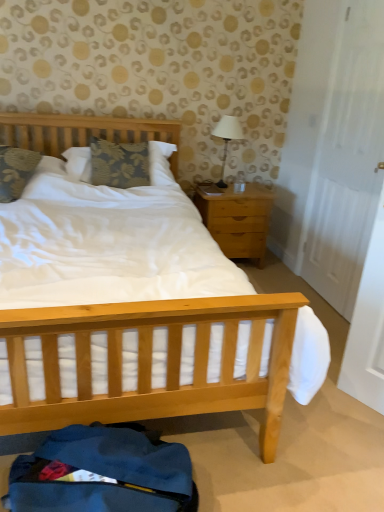
Question: Does floral fabric pillow at left, arranged as the second pillow when viewed from the right, have a lesser width compared to white fabric-covered lamp at upper right?

Choices:
 (A) yes
 (B) no

Answer: (B)

Question: Is white fabric-covered lamp at upper right inside floral fabric pillow at left, arranged as the second pillow when viewed from the right?

Choices:
 (A) no
 (B) yes

Answer: (A)

Question: Can you confirm if floral fabric pillow at left, arranged as the first pillow when viewed from the left, is smaller than white fabric-covered lamp at upper right?

Choices:
 (A) yes
 (B) no

Answer: (B)

Question: Considering the relative positions of floral fabric pillow at left, arranged as the second pillow when viewed from the right, and white fabric-covered lamp at upper right in the image provided, is floral fabric pillow at left, arranged as the second pillow when viewed from the right, to the left of white fabric-covered lamp at upper right from the viewer's perspective?

Choices:
 (A) yes
 (B) no

Answer: (A)

Question: From the image's perspective, would you say floral fabric pillow at left, arranged as the first pillow when viewed from the left, is positioned over white fabric-covered lamp at upper right?

Choices:
 (A) yes
 (B) no

Answer: (B)

Question: Is floral fabric pillow at left, arranged as the first pillow when viewed from the left, positioned before white fabric-covered lamp at upper right?

Choices:
 (A) yes
 (B) no

Answer: (A)

Question: Does light wood/texture nightstand at right appear on the left side of floral fabric pillow at left, arranged as the second pillow when viewed from the right?

Choices:
 (A) no
 (B) yes

Answer: (A)

Question: Is light wood/texture nightstand at right located outside floral fabric pillow at left, arranged as the first pillow when viewed from the left?

Choices:
 (A) yes
 (B) no

Answer: (A)

Question: Is light wood/texture nightstand at right wider than floral fabric pillow at left, arranged as the second pillow when viewed from the right?

Choices:
 (A) yes
 (B) no

Answer: (B)

Question: Is light wood/texture nightstand at right aimed at floral fabric pillow at left, arranged as the second pillow when viewed from the right?

Choices:
 (A) no
 (B) yes

Answer: (A)

Question: Does light wood/texture nightstand at right have a lesser width compared to floral fabric pillow at left, arranged as the second pillow when viewed from the right?

Choices:
 (A) yes
 (B) no

Answer: (A)

Question: Is light wood/texture nightstand at right directly adjacent to floral fabric pillow at left, arranged as the second pillow when viewed from the right?

Choices:
 (A) yes
 (B) no

Answer: (B)

Question: Is floral fabric pillow at left, arranged as the second pillow when viewed from the right, far from white matte door at right?

Choices:
 (A) no
 (B) yes

Answer: (B)